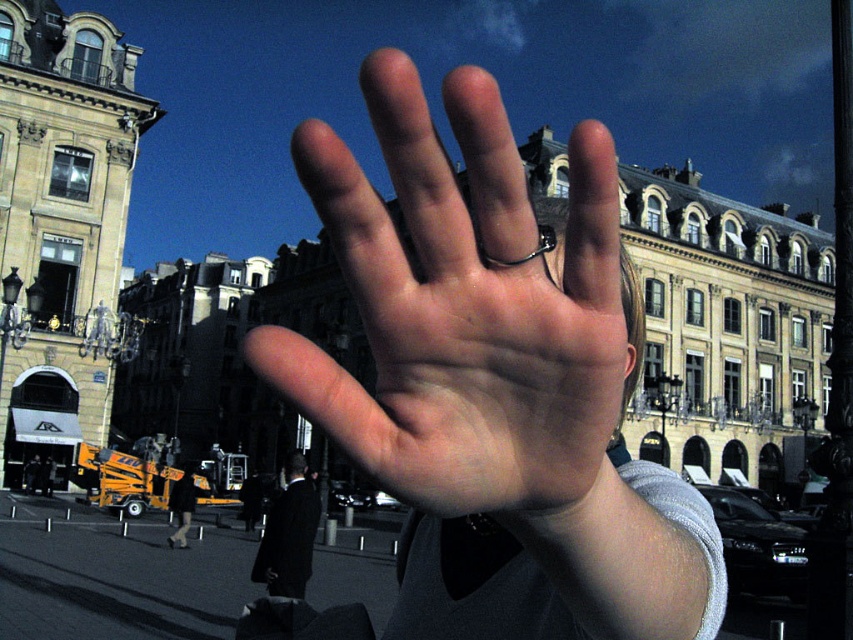
Does point (511, 248) come in front of point (494, 260)?

Yes.

Between smooth skin hand at center and silver metallic ring at center, which one is positioned lower?

smooth skin hand at center is below.

This screenshot has height=640, width=853. What do you see at coordinates (460, 324) in the screenshot? I see `smooth skin hand at center` at bounding box center [460, 324].

This screenshot has height=640, width=853. I want to click on smooth skin hand at center, so (460, 324).

Is point (334, 381) more distant than point (292, 579)?

No, it is not.

Between smooth skin hand at center and dark suit at center, which one appears on the right side from the viewer's perspective?

From the viewer's perspective, smooth skin hand at center appears more on the right side.

You are a GUI agent. You are given a task and a screenshot of the screen. Output one action in this format:
    pyautogui.click(x=<x>, y=<y>)
    Task: Click on the smooth skin hand at center
    Image resolution: width=853 pixels, height=640 pixels.
    Given the screenshot: What is the action you would take?
    pyautogui.click(x=460, y=324)

Who is lower down, dark suit at center or silver metallic ring at center?

Positioned lower is dark suit at center.

Is point (291, 547) closer to camera compared to point (538, 252)?

No.

Where is `dark suit at center`? The image size is (853, 640). dark suit at center is located at coordinates (288, 534).